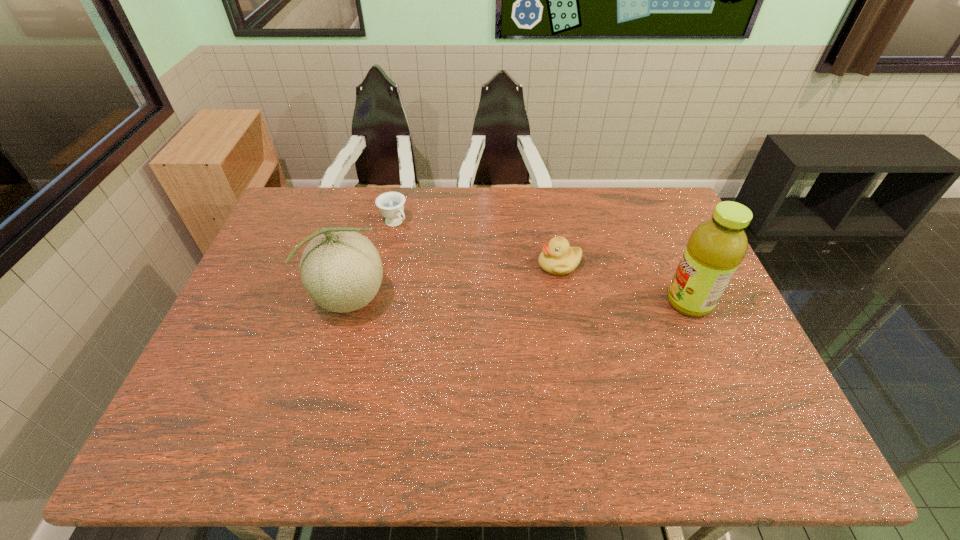
In the image, there is a desktop. In order to click on vacant area at the left edge in this screenshot , I will do `click(238, 299)`.

In the image, there is a desktop. Where is `vacant space at the right edge`? The height and width of the screenshot is (540, 960). vacant space at the right edge is located at coordinates (716, 360).

Where is `vacant region at the far left corner`? This screenshot has height=540, width=960. vacant region at the far left corner is located at coordinates (304, 209).

Where is `free space at the far right corner`? free space at the far right corner is located at coordinates (639, 193).

Find the location of `free point between the cantaloup and the fruit juice`. free point between the cantaloup and the fruit juice is located at coordinates (521, 301).

At what (x,y) coordinates should I click in order to perform the action: click on vacant space that is in between the fruit juice and the duckling. Please return your answer as a coordinate pair (x, y). The width and height of the screenshot is (960, 540). Looking at the image, I should click on (624, 284).

Locate an element on the screen. The height and width of the screenshot is (540, 960). vacant area that lies between the third tallest object and the farthest object is located at coordinates (476, 244).

Where is `vacant region between the cantaloup and the fruit juice`? Image resolution: width=960 pixels, height=540 pixels. vacant region between the cantaloup and the fruit juice is located at coordinates (521, 301).

What are the coordinates of `free space between the fruit juice and the cantaloup` in the screenshot? It's located at (521, 301).

Find the location of a particular element. free space that is in between the third object from left to right and the rightmost object is located at coordinates (624, 284).